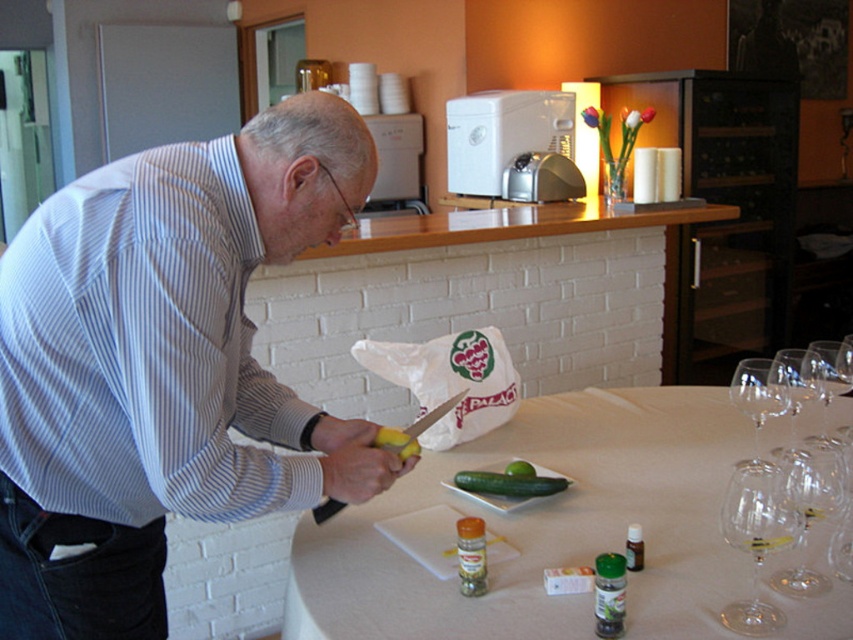
You are a bartender preparing drinks and need to choose between the transparent glass wine glass at lower right and the green smooth pickle at center to hold a liquid. Which object can hold more liquid based on their sizes?

The green smooth pickle at center can hold more liquid because it is thicker than the transparent glass wine glass at lower right.

You are standing in the kitchen and see the point at coordinates (x=811, y=484). If you want to reach it without moving your feet, can you do so with your outstretched hand?

The point at coordinates (x=811, y=484) is 1.25 meters away from the viewer. Since the average person can reach about 1 meter with their arm, you would not be able to reach it without moving your feet.